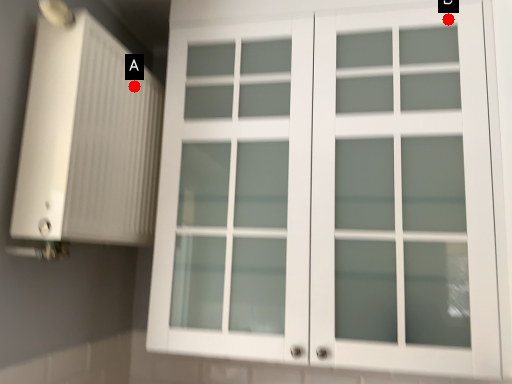
Question: Two points are circled on the image, labeled by A and B beside each circle. Among these points, which one is nearest to the camera?

Choices:
 (A) A is closer
 (B) B is closer

Answer: (B)